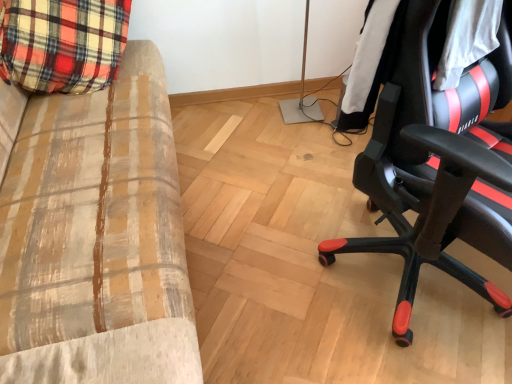
Question: Looking at their shapes, would you say black leather jacket at right is wider or thinner than black leather chair at right?

Choices:
 (A) thin
 (B) wide

Answer: (A)

Question: Is black leather jacket at right situated inside black leather chair at right or outside?

Choices:
 (A) outside
 (B) inside

Answer: (B)

Question: Which object is positioned closest to the plaid fabric couch at left?

Choices:
 (A) black leather jacket at right
 (B) black leather chair at right

Answer: (B)

Question: Estimate the real-world distances between objects in this image. Which object is closer to the plaid fabric couch at left?

Choices:
 (A) black leather chair at right
 (B) black leather jacket at right

Answer: (A)